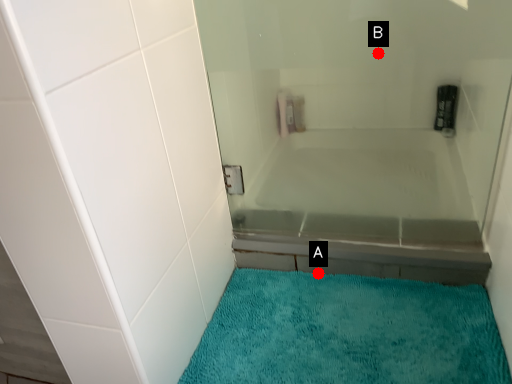
Question: Two points are circled on the image, labeled by A and B beside each circle. Which point is closer to the camera?

Choices:
 (A) A is closer
 (B) B is closer

Answer: (B)